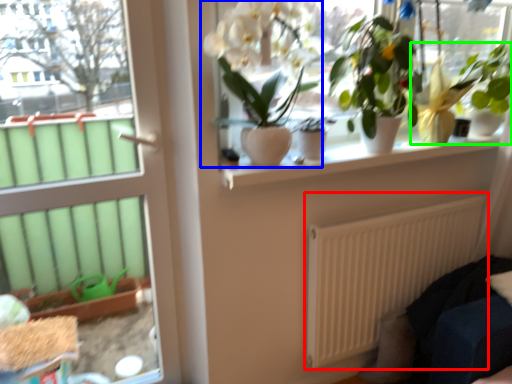
Question: Which object is positioned farthest from radiator (highlighted by a red box)? Select from houseplant (highlighted by a blue box) and houseplant (highlighted by a green box).

Choices:
 (A) houseplant
 (B) houseplant

Answer: (A)